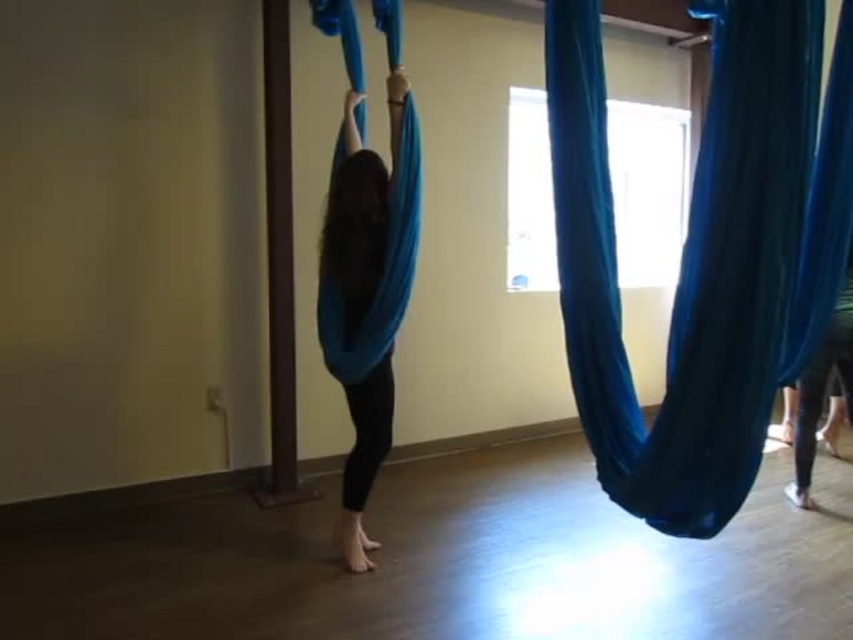
You are an instructor preparing to hang two different blue fabrics in the aerial yoga studio. You have a blue fabric hammock at right and a matte blue fabric at center. Based on their sizes, which one would you recommend for a beginner who needs more support?

The blue fabric hammock at right is bigger than the matte blue fabric at center, so it provides more support and stability, making it suitable for beginners.

You are standing in the room and want to reach the blue fabric hammock at right. Based on the coordinates provided, in which direction should you move from your current position at the center of the room?

The blue fabric hammock at right is located at coordinates 0.395 on the x axis and 0.828 on the y axis. Since you are at the center of the room, you should move towards the right and forward to reach it.